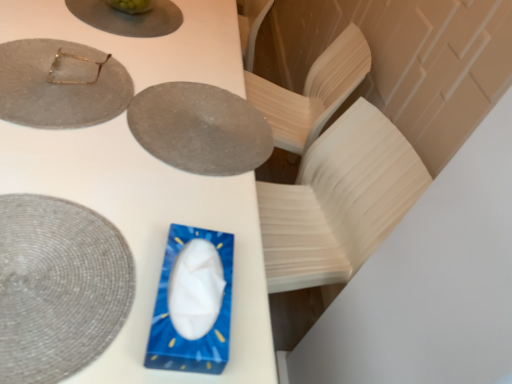
The width and height of the screenshot is (512, 384). Find the location of `vacant space behind gold metallic glasses at upper left`. vacant space behind gold metallic glasses at upper left is located at coordinates (111, 36).